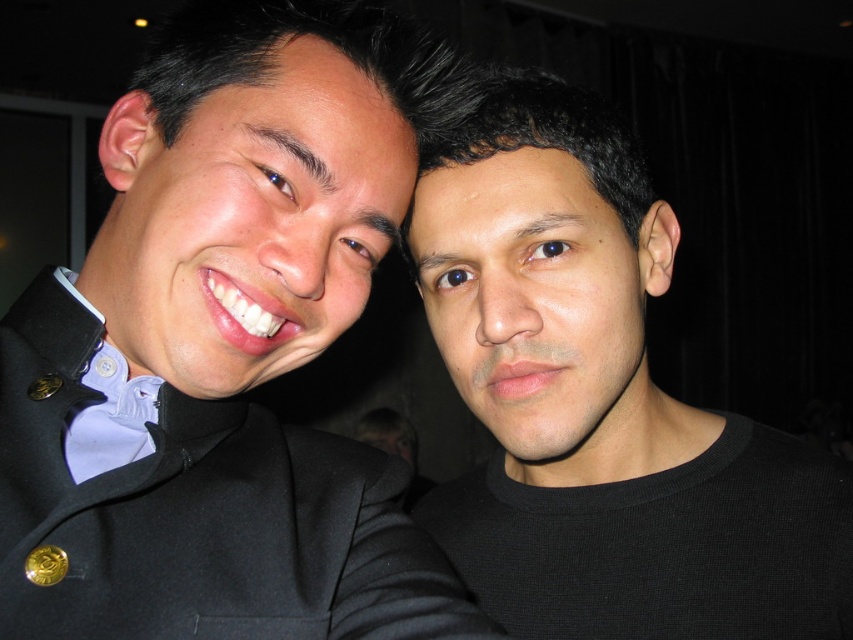
Question: Does black matte suit at left appear under black matte shirt at right?

Choices:
 (A) yes
 (B) no

Answer: (B)

Question: Is black matte suit at left closer to camera compared to black matte shirt at right?

Choices:
 (A) no
 (B) yes

Answer: (B)

Question: Is black matte suit at left to the left of black matte shirt at right from the viewer's perspective?

Choices:
 (A) yes
 (B) no

Answer: (A)

Question: Among these points, which one is farthest from the camera?

Choices:
 (A) (252, 369)
 (B) (621, 310)

Answer: (B)

Question: Which point is farther to the camera?

Choices:
 (A) black matte shirt at right
 (B) black matte suit at left

Answer: (A)